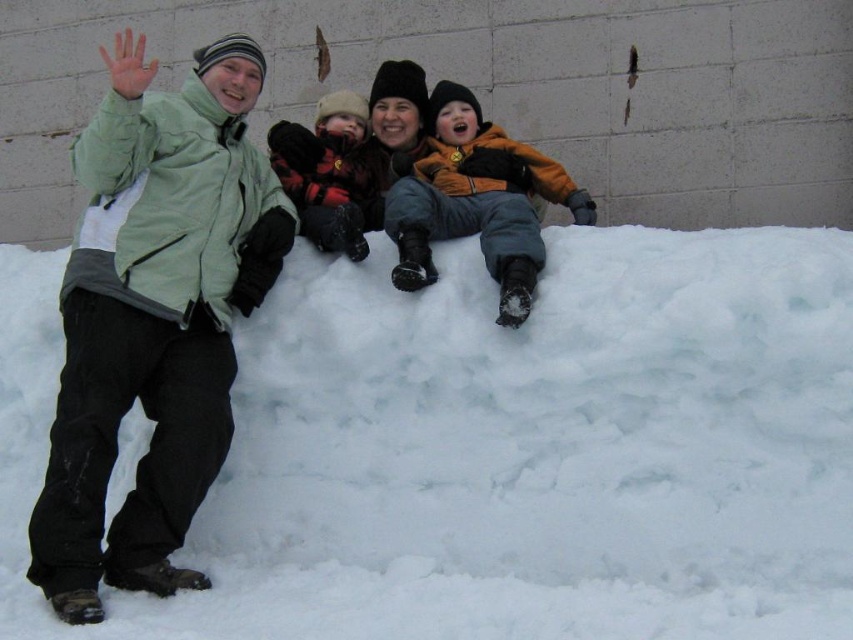
You are a photographer trying to capture a clear photo of the orange fleece jacket at center and the flannel shirt at center. Since both are at center, which one will appear closer to the camera in the photo?

The orange fleece jacket at center will appear closer to the camera because it is in front of the flannel shirt at center.

You are trying to build a snowman using the white fluffy snow at lower center and the orange fleece jacket at center. Since the snow is less wide than the jacket, will the snowman be wider than the jacket?

The white fluffy snow at lower center is less wide than the orange fleece jacket at center, so the snowman made from the white fluffy snow at lower center would not be wider than the jacket.